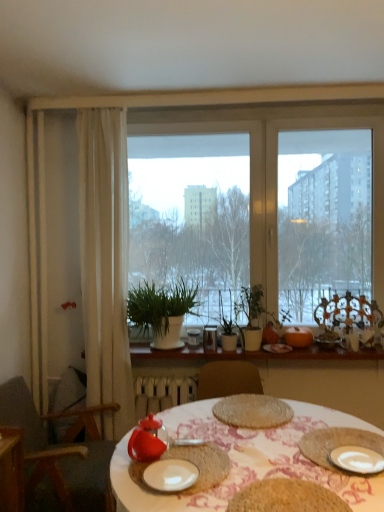
Question: Does wooden at center touch white sheer curtain at left?

Choices:
 (A) no
 (B) yes

Answer: (A)

Question: Is wooden at center positioned with its back to white sheer curtain at left?

Choices:
 (A) no
 (B) yes

Answer: (A)

Question: Considering the relative sizes of wooden at center and white sheer curtain at left in the image provided, is wooden at center smaller than white sheer curtain at left?

Choices:
 (A) yes
 (B) no

Answer: (A)

Question: Considering the relative sizes of wooden at center and white sheer curtain at left in the image provided, is wooden at center bigger than white sheer curtain at left?

Choices:
 (A) yes
 (B) no

Answer: (B)

Question: From a real-world perspective, is wooden at center beneath white sheer curtain at left?

Choices:
 (A) yes
 (B) no

Answer: (A)

Question: Does wooden at center have a greater width compared to white sheer curtain at left?

Choices:
 (A) yes
 (B) no

Answer: (A)

Question: Is green matte plant at center bigger than transparent glass window at center?

Choices:
 (A) no
 (B) yes

Answer: (A)

Question: From the image's perspective, does green matte plant at center appear lower than transparent glass window at center?

Choices:
 (A) no
 (B) yes

Answer: (B)

Question: From the image's perspective, is green matte plant at center above transparent glass window at center?

Choices:
 (A) no
 (B) yes

Answer: (A)

Question: Is green matte plant at center oriented towards transparent glass window at center?

Choices:
 (A) yes
 (B) no

Answer: (B)

Question: Is the surface of green matte plant at center in direct contact with transparent glass window at center?

Choices:
 (A) no
 (B) yes

Answer: (A)

Question: Does green matte plant at center have a greater height compared to transparent glass window at center?

Choices:
 (A) yes
 (B) no

Answer: (B)

Question: Is white sheer curtain at left positioned behind green matte plant at center?

Choices:
 (A) no
 (B) yes

Answer: (A)